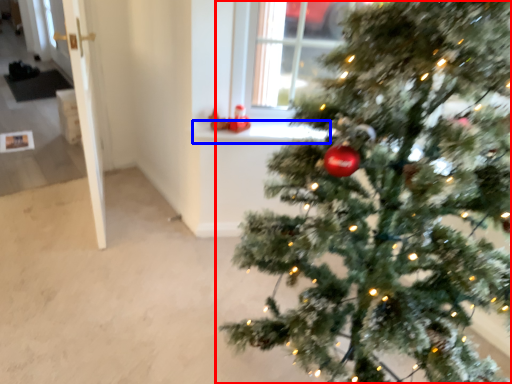
Question: Which object is closer to the camera taking this photo, christmas tree (highlighted by a red box) or window sill (highlighted by a blue box)?

Choices:
 (A) christmas tree
 (B) window sill

Answer: (A)